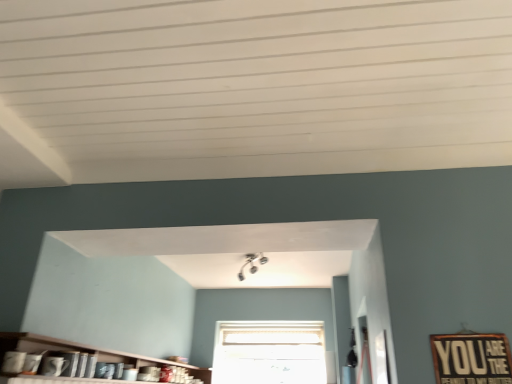
You are a GUI agent. You are given a task and a screenshot of the screen. Output one action in this format:
    pyautogui.click(x=<x>, y=<y>)
    Task: Click on the white frosted glass window at center
    This screenshot has height=384, width=512.
    Given the screenshot: What is the action you would take?
    pyautogui.click(x=269, y=352)

What do you see at coordinates (269, 352) in the screenshot? I see `white frosted glass window at center` at bounding box center [269, 352].

In order to click on matte wooden shelf at lower left in this screenshot , I will do `click(70, 349)`.

Describe the element at coordinates (70, 349) in the screenshot. The height and width of the screenshot is (384, 512). I see `matte wooden shelf at lower left` at that location.

What is the approximate height of matte wooden shelf at lower left?

It is 7.81 inches.

Identify the location of white frosted glass window at center. (269, 352).

Is white frosted glass window at center to the left of matte wooden shelf at lower left from the viewer's perspective?

Incorrect, white frosted glass window at center is not on the left side of matte wooden shelf at lower left.

Considering the positions of objects white frosted glass window at center and matte wooden shelf at lower left in the image provided, who is in front, white frosted glass window at center or matte wooden shelf at lower left?

matte wooden shelf at lower left is closer to the camera.

Does point (282, 381) come closer to viewer compared to point (127, 358)?

No, (282, 381) is further to viewer.

From the image's perspective, relative to matte wooden shelf at lower left, is white frosted glass window at center above or below?

white frosted glass window at center is situated lower than matte wooden shelf at lower left in the image.

From a real-world perspective, is white frosted glass window at center located beneath matte wooden shelf at lower left?

No, from a real-world perspective, white frosted glass window at center is not below matte wooden shelf at lower left.

Between white frosted glass window at center and matte wooden shelf at lower left, which one has smaller width?

white frosted glass window at center is thinner.

From their relative heights in the image, would you say white frosted glass window at center is taller or shorter than matte wooden shelf at lower left?

Considering their sizes, white frosted glass window at center has more height than matte wooden shelf at lower left.

Between white frosted glass window at center and matte wooden shelf at lower left, which one has larger size?

matte wooden shelf at lower left.

Is matte wooden shelf at lower left inside white frosted glass window at center?

Definitely not — matte wooden shelf at lower left is not inside white frosted glass window at center.

Is white frosted glass window at center touching matte wooden shelf at lower left?

No, white frosted glass window at center is not in contact with matte wooden shelf at lower left.

Is white frosted glass window at center looking in the opposite direction of matte wooden shelf at lower left?

No, white frosted glass window at center's orientation is not away from matte wooden shelf at lower left.

How many degrees apart are the facing directions of white frosted glass window at center and matte wooden shelf at lower left?

The facing directions of white frosted glass window at center and matte wooden shelf at lower left are 90.7 degrees apart.

Where is `window below the matte wooden shelf at lower left (from the image's perspective)`? Image resolution: width=512 pixels, height=384 pixels. window below the matte wooden shelf at lower left (from the image's perspective) is located at coordinates (269, 352).

Does matte wooden shelf at lower left appear on the left side of white frosted glass window at center?

Yes.

Which is in front, matte wooden shelf at lower left or white frosted glass window at center?

matte wooden shelf at lower left is in front.

Is point (200, 369) more distant than point (222, 355)?

No, it is not.

From the image's perspective, relative to white frosted glass window at center, is matte wooden shelf at lower left above or below?

matte wooden shelf at lower left is above white frosted glass window at center.

From a real-world perspective, which object rests below the other?

In real-world perspective, matte wooden shelf at lower left is lower.

Between matte wooden shelf at lower left and white frosted glass window at center, which one has smaller width?

white frosted glass window at center.

Which of these two, matte wooden shelf at lower left or white frosted glass window at center, stands taller?

white frosted glass window at center.

Which of these two, matte wooden shelf at lower left or white frosted glass window at center, is smaller?

white frosted glass window at center.

Is white frosted glass window at center a part of matte wooden shelf at lower left?

No.

Would you consider matte wooden shelf at lower left to be distant from white frosted glass window at center?

Yes, matte wooden shelf at lower left and white frosted glass window at center are quite far apart.

Is matte wooden shelf at lower left facing towards white frosted glass window at center?

No, matte wooden shelf at lower left is not oriented towards white frosted glass window at center.

Can you tell me how much matte wooden shelf at lower left and white frosted glass window at center differ in facing direction?

The facing directions of matte wooden shelf at lower left and white frosted glass window at center are 90.7 degrees apart.

Locate an element on the screen. The image size is (512, 384). window below the matte wooden shelf at lower left (from the image's perspective) is located at coordinates (269, 352).

Locate an element on the screen. window behind the matte wooden shelf at lower left is located at coordinates (269, 352).

You are a GUI agent. You are given a task and a screenshot of the screen. Output one action in this format:
    pyautogui.click(x=<x>, y=<y>)
    Task: Click on the shelf on the left of white frosted glass window at center
    The image size is (512, 384).
    Given the screenshot: What is the action you would take?
    pyautogui.click(x=70, y=349)